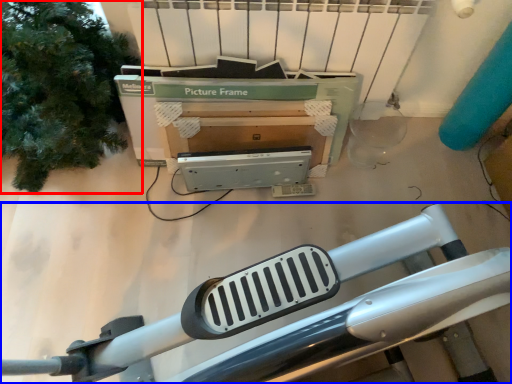
Question: Which point is closer to the camera, tree (highlighted by a red box) or furniture (highlighted by a blue box)?

Choices:
 (A) tree
 (B) furniture

Answer: (A)